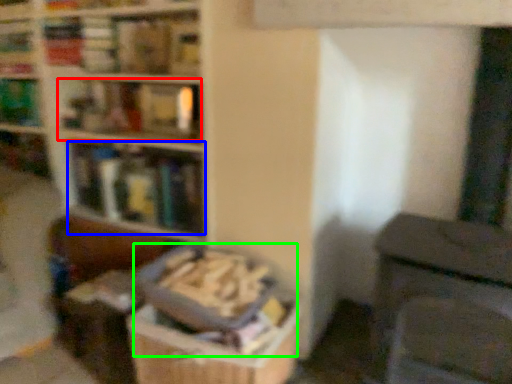
Question: Which is nearer to the book (highlighted by a red box)? book (highlighted by a blue box) or book (highlighted by a green box).

Choices:
 (A) book
 (B) book

Answer: (A)